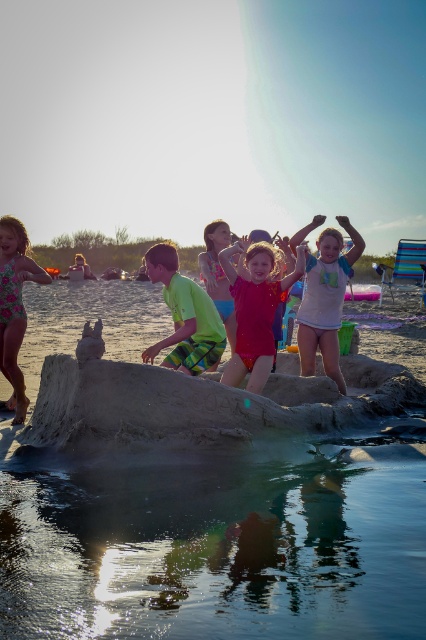
Can you confirm if clear water at sand center is positioned above bright red fabric at center?

Incorrect, clear water at sand center is not positioned above bright red fabric at center.

Between clear water at sand center and bright red fabric at center, which one has less height?

bright red fabric at center is shorter.

Between point (183, 618) and point (227, 321), which one is positioned in front?

Point (183, 618) is in front.

I want to click on clear water at sand center, so click(212, 545).

Can you confirm if clear water at sand center is wider than matte pink swimsuit at center?

Yes, clear water at sand center is wider than matte pink swimsuit at center.

Which is more to the left, clear water at sand center or matte pink swimsuit at center?

From the viewer's perspective, matte pink swimsuit at center appears more on the left side.

Describe the element at coordinates (212, 545) in the screenshot. This screenshot has width=426, height=640. I see `clear water at sand center` at that location.

Locate an element on the screen. The image size is (426, 640). clear water at sand center is located at coordinates (212, 545).

In the scene shown: Between white cotton shirt at center and floral print swimsuit at left, which one is positioned lower?

floral print swimsuit at left

Does point (333, 241) come in front of point (20, 244)?

That is False.

This screenshot has height=640, width=426. I want to click on white cotton shirt at center, so click(x=325, y=300).

This screenshot has width=426, height=640. I want to click on white cotton shirt at center, so click(325, 300).